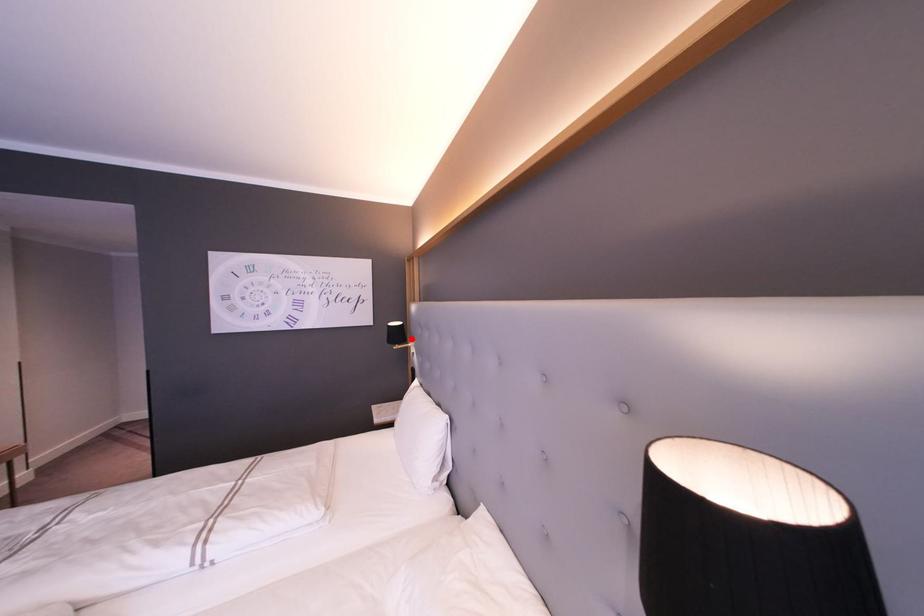
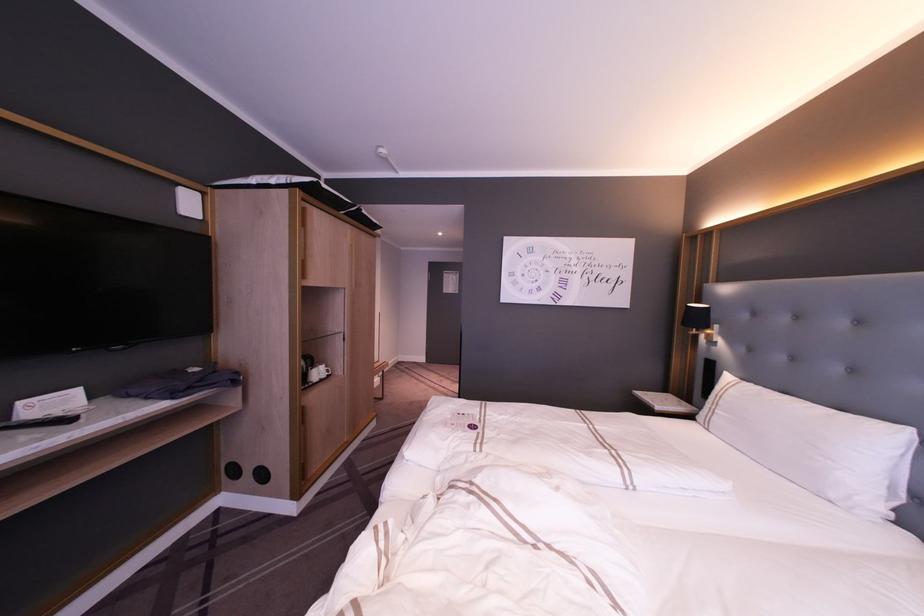
Question: I am providing you with two images of the same scene from different viewpoints. A red point is marked on the first image. Can you still see the location of the red point in image 2?

Choices:
 (A) Yes
 (B) No

Answer: (A)